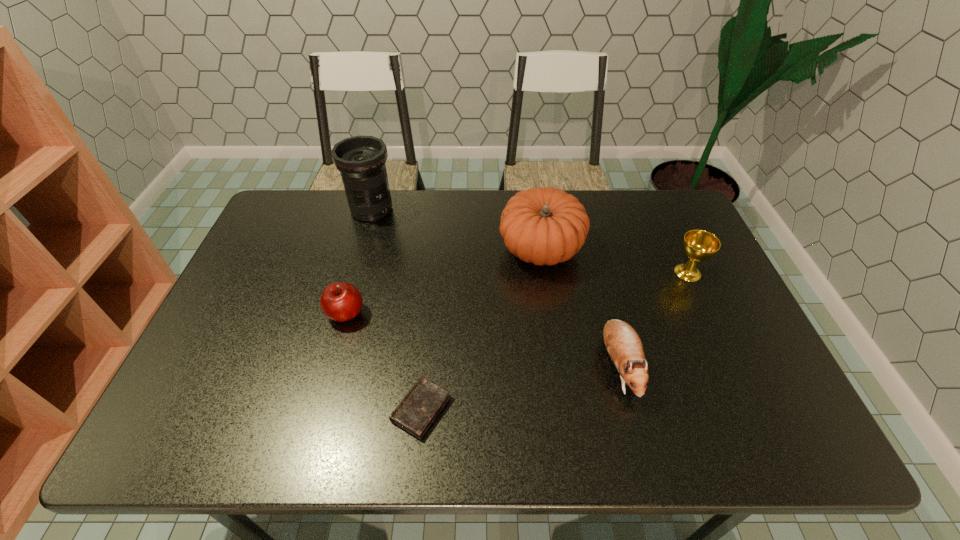
Identify the location of free location located 0.080m on the left of the apple. Image resolution: width=960 pixels, height=540 pixels. (297, 314).

This screenshot has height=540, width=960. I want to click on free space located 0.320m on the left of the shortest object, so click(251, 408).

You are a GUI agent. You are given a task and a screenshot of the screen. Output one action in this format:
    pyautogui.click(x=<x>, y=<y>)
    Task: Click on the telephoto lens situated at the far edge
    
    Given the screenshot: What is the action you would take?
    pyautogui.click(x=361, y=160)

Identify the location of pumpkin that is at the far edge. Image resolution: width=960 pixels, height=540 pixels. (545, 226).

Identify the location of object at the near edge. (418, 409).

Where is `object positioned at the right edge`? The height and width of the screenshot is (540, 960). object positioned at the right edge is located at coordinates (698, 245).

The width and height of the screenshot is (960, 540). I want to click on free space at the far edge, so click(x=461, y=217).

At what (x,y) coordinates should I click in order to perform the action: click on free space at the near edge of the desktop. Please return your answer as a coordinate pair (x, y). Looking at the image, I should click on (637, 442).

Find the location of a particular element. This screenshot has width=960, height=540. vacant space at the left edge is located at coordinates (227, 323).

Locate an element on the screen. The image size is (960, 540). vacant region at the right edge of the desktop is located at coordinates pos(732,321).